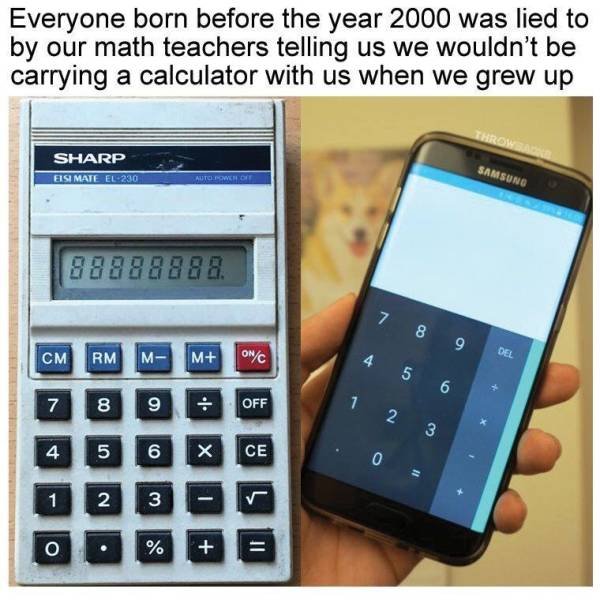
Locate an element on the screen. The image size is (600, 600). screen is located at coordinates (240, 252), (483, 241).